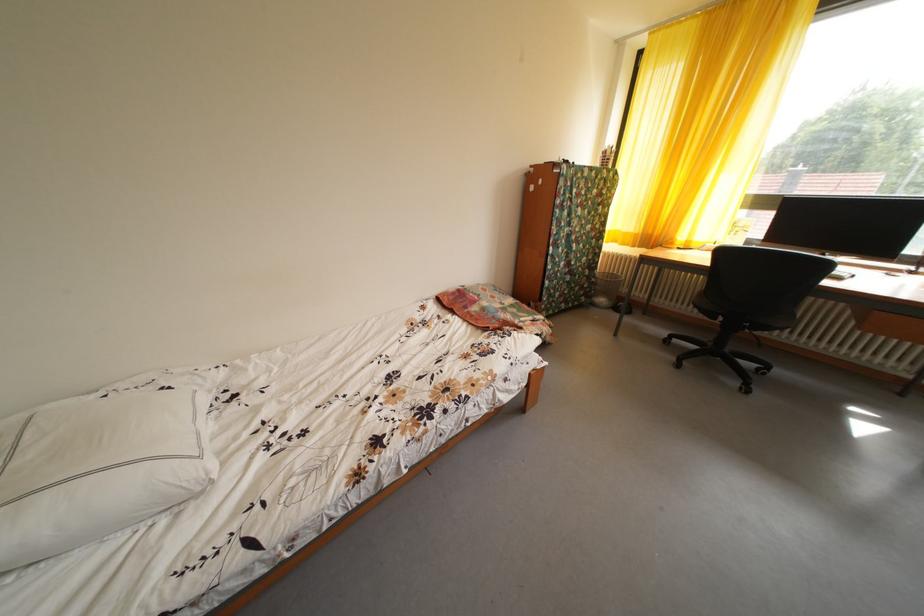
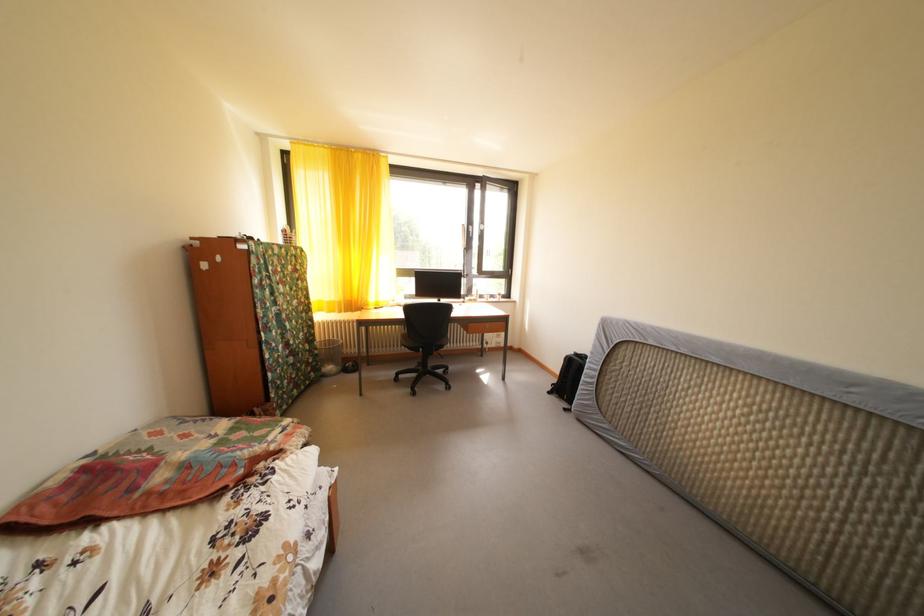
Question: The camera is either moving clockwise (left) or counter-clockwise (right) around the object. The first image is from the beginning of the video and the second image is from the end. Is the camera moving left or right when shooting the video?

Choices:
 (A) Left
 (B) Right

Answer: (A)